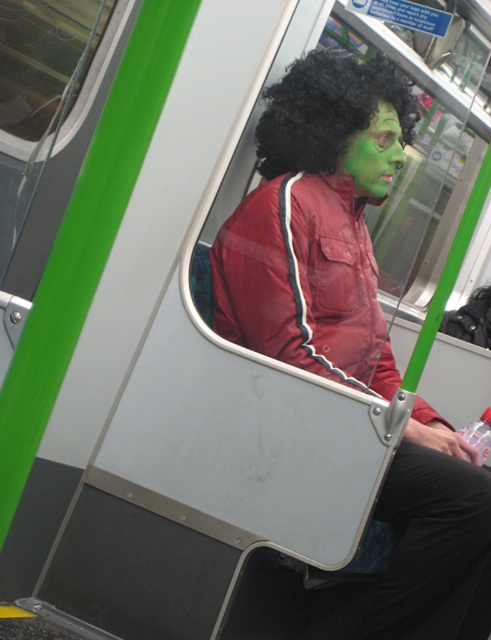
Question: Can you confirm if black curly wig at upper center is positioned below green matte face at center?

Choices:
 (A) yes
 (B) no

Answer: (B)

Question: Among these objects, which one is farthest from the camera?

Choices:
 (A) green matte face at center
 (B) black curly wig at upper center

Answer: (A)

Question: Among these points, which one is farthest from the camera?

Choices:
 (A) (320, 68)
 (B) (354, 172)

Answer: (B)

Question: Is black curly wig at upper center positioned before green matte face at center?

Choices:
 (A) yes
 (B) no

Answer: (A)

Question: Can you confirm if black curly wig at upper center is smaller than green matte face at center?

Choices:
 (A) yes
 (B) no

Answer: (B)